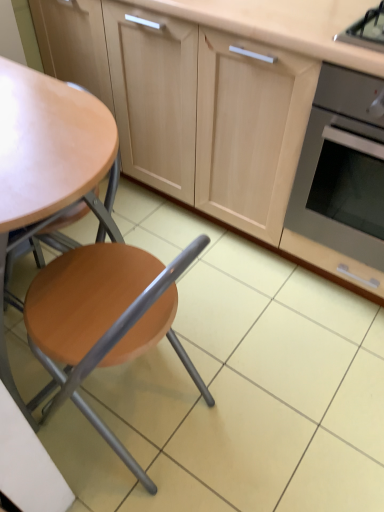
The height and width of the screenshot is (512, 384). What do you see at coordinates (289, 100) in the screenshot?
I see `matte wood cabinetry at center` at bounding box center [289, 100].

Measure the distance between stainless steel oven at right and camera.

stainless steel oven at right and camera are 3.43 feet apart from each other.

Find the location of a particular element. matte wood cabinetry at center is located at coordinates (289, 100).

From a real-world perspective, who is located lower, stainless steel oven at right or matte wood chair at left?

In real-world perspective, matte wood chair at left is lower.

Does stainless steel oven at right touch matte wood chair at left?

No.

Is point (343, 190) positioned after point (76, 373)?

Yes, it is behind point (76, 373).

From the image's perspective, who appears lower, matte wood cabinetry at center or matte wood chair at left?

matte wood chair at left, from the image's perspective.

Which of these two, matte wood cabinetry at center or matte wood chair at left, is bigger?

matte wood cabinetry at center.

Choose the correct answer: Is matte wood cabinetry at center inside matte wood chair at left or outside it?

matte wood cabinetry at center is not enclosed by matte wood chair at left.

Which is behind, stainless steel oven at right or matte wood cabinetry at center?

stainless steel oven at right is further away from the camera.

In the scene shown: Is stainless steel oven at right shorter than matte wood cabinetry at center?

Indeed, stainless steel oven at right has a lesser height compared to matte wood cabinetry at center.

Considering the sizes of objects stainless steel oven at right and matte wood cabinetry at center in the image provided, who is thinner, stainless steel oven at right or matte wood cabinetry at center?

matte wood cabinetry at center is thinner.

Which point is more distant from viewer, (314, 206) or (323, 35)?

The point (314, 206) is more distant.

Which is in front, point (137, 304) or point (123, 165)?

The point (137, 304) is closer to the camera.

Between matte wood chair at left and matte wood cabinetry at center, which one appears on the left side from the viewer's perspective?

From the viewer's perspective, matte wood chair at left appears more on the left side.

Is matte wood chair at left situated inside matte wood cabinetry at center or outside?

matte wood chair at left lies outside matte wood cabinetry at center.

Would you say matte wood chair at left is a long distance from matte wood cabinetry at center?

matte wood chair at left is actually quite close to matte wood cabinetry at center.

Considering the relative sizes of matte wood cabinetry at center and stainless steel oven at right in the image provided, is matte wood cabinetry at center bigger than stainless steel oven at right?

Yes, matte wood cabinetry at center is bigger than stainless steel oven at right.

From the picture: Between matte wood cabinetry at center and stainless steel oven at right, which one appears on the right side from the viewer's perspective?

Positioned to the right is stainless steel oven at right.

From the image's perspective, who appears lower, matte wood cabinetry at center or stainless steel oven at right?

stainless steel oven at right is shown below in the image.

Is matte wood chair at left taller or shorter than stainless steel oven at right?

In the image, matte wood chair at left appears to be taller than stainless steel oven at right.

Is matte wood chair at left looking in the opposite direction of stainless steel oven at right?

matte wood chair at left does not have its back to stainless steel oven at right.

From the image's perspective, which is below, matte wood chair at left or stainless steel oven at right?

From the image's view, matte wood chair at left is below.

Which point is more distant from viewer, (50,339) or (382,238)?

The point (382,238) is farther from the camera.

I want to click on chair below the stainless steel oven at right (from a real-world perspective), so click(x=105, y=313).

In the image, there is a matte wood cabinetry at center. In order to click on chair below it (from the image's perspective) in this screenshot , I will do `click(105, 313)`.

Based on their spatial positions, is stainless steel oven at right or matte wood chair at left further from matte wood cabinetry at center?

matte wood chair at left.

Looking at the image, which one is located further to matte wood chair at left, stainless steel oven at right or matte wood cabinetry at center?

The object further to matte wood chair at left is matte wood cabinetry at center.

Estimate the real-world distances between objects in this image. Which object is further from stainless steel oven at right, matte wood cabinetry at center or matte wood chair at left?

Among the two, matte wood chair at left is located further to stainless steel oven at right.

Estimate the real-world distances between objects in this image. Which object is further from matte wood cabinetry at center, matte wood chair at left or stainless steel oven at right?

matte wood chair at left lies further to matte wood cabinetry at center than the other object.

Looking at this image, estimate the real-world distances between objects in this image. Which object is closer to stainless steel oven at right, matte wood chair at left or matte wood cabinetry at center?

matte wood cabinetry at center lies closer to stainless steel oven at right than the other object.

Which object lies further to the anchor point matte wood chair at left, matte wood cabinetry at center or stainless steel oven at right?

matte wood cabinetry at center.

Where is `cabinetry between matte wood chair at left and stainless steel oven at right`? cabinetry between matte wood chair at left and stainless steel oven at right is located at coordinates (289, 100).